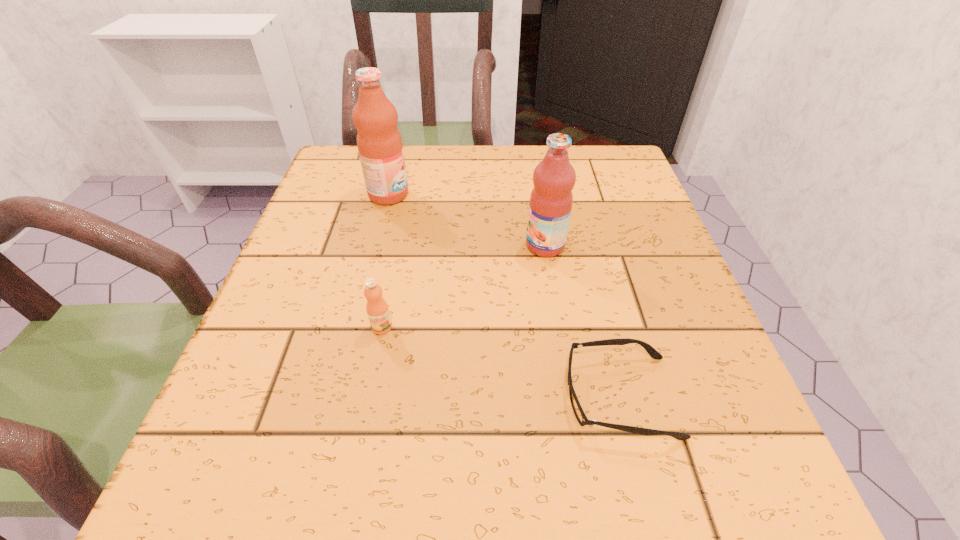
Identify the location of the tallest object. (379, 142).

The image size is (960, 540). Find the location of `the taller fruit juice`. the taller fruit juice is located at coordinates pyautogui.click(x=379, y=142).

At what (x,y) coordinates should I click in order to perform the action: click on the nearer fruit juice. Please return your answer as a coordinate pair (x, y). The height and width of the screenshot is (540, 960). Looking at the image, I should click on (551, 199).

You are a GUI agent. You are given a task and a screenshot of the screen. Output one action in this format:
    pyautogui.click(x=<x>, y=<y>)
    Task: Click on the third shortest object
    This screenshot has height=540, width=960.
    Given the screenshot: What is the action you would take?
    coord(551,199)

Identify the location of the third farthest object. The height and width of the screenshot is (540, 960). (377, 309).

Identify the location of the third tallest object. (377, 309).

This screenshot has height=540, width=960. Identify the location of the nearest object. (577, 409).

The width and height of the screenshot is (960, 540). In order to click on the shortest object in this screenshot , I will do [577, 409].

You are a GUI agent. You are given a task and a screenshot of the screen. Output one action in this format:
    pyautogui.click(x=<x>, y=<y>)
    Task: Click on the vacant region located on the front label of the tallest object
    This screenshot has height=540, width=960.
    Given the screenshot: What is the action you would take?
    pyautogui.click(x=568, y=195)

I want to click on vacant space located 0.190m on the front label of the nearer fruit juice, so click(x=429, y=246).